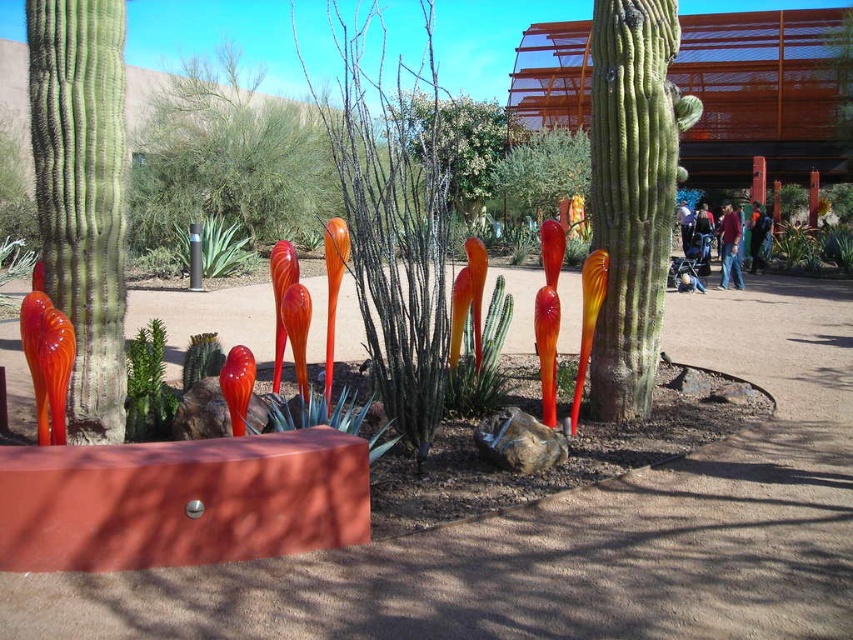
What do you see at coordinates (215, 246) in the screenshot? The height and width of the screenshot is (640, 853). I see `green leafy plant at center` at bounding box center [215, 246].

Locate an element on the screen. green leafy plant at center is located at coordinates (215, 246).

Is translucent orange glass cactus at center in front of green matte plant at center?

No, it is not.

Can you confirm if translucent orange glass cactus at center is taller than green matte plant at center?

Yes.

Between point (494, 376) and point (126, 340), which one is positioned behind?

The point (126, 340) is behind.

What are the coordinates of `translucent orange glass cactus at center` in the screenshot? It's located at (480, 360).

How distant is translucent glass vase at right from green succulent at center?

translucent glass vase at right and green succulent at center are 17.38 meters apart from each other.

Image resolution: width=853 pixels, height=640 pixels. What do you see at coordinates (795, 248) in the screenshot?
I see `translucent glass vase at right` at bounding box center [795, 248].

Looking at this image, who is more forward, (807, 230) or (212, 368)?

Point (212, 368) is more forward.

Locate an element on the screen. Image resolution: width=853 pixels, height=640 pixels. translucent glass vase at right is located at coordinates (795, 248).